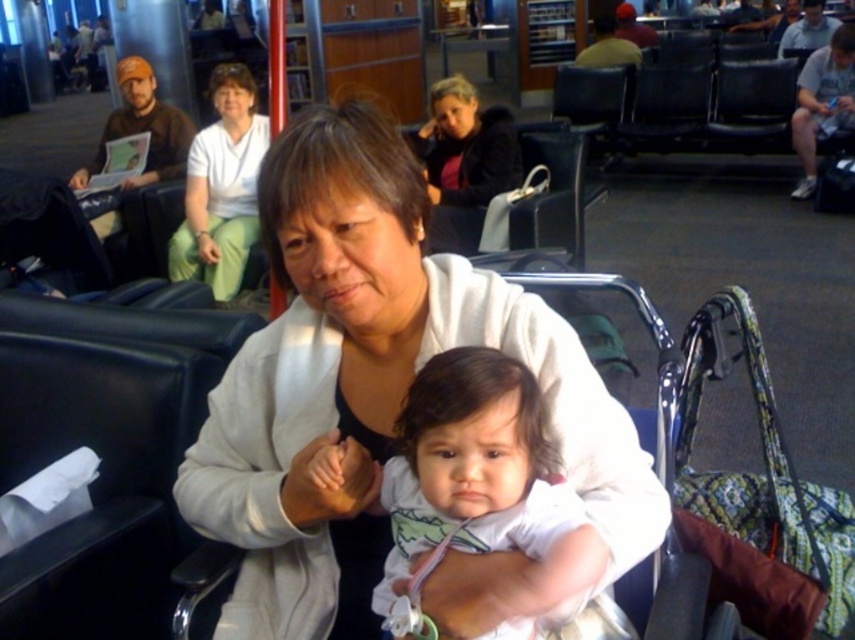
Can you confirm if white fabric shirt at upper center is shorter than matte black jacket at upper center?

No.

Does white fabric shirt at upper center have a greater width compared to matte black jacket at upper center?

Incorrect, white fabric shirt at upper center's width does not surpass matte black jacket at upper center's.

Describe the element at coordinates (221, 188) in the screenshot. The image size is (855, 640). I see `white fabric shirt at upper center` at that location.

Identify the location of white fabric shirt at upper center. This screenshot has width=855, height=640. pyautogui.click(x=221, y=188).

Between point (228, 488) and point (565, 596), which one is positioned behind?

Positioned behind is point (228, 488).

Between white soft jacket at center and white soft fabric baby at center, which one appears on the right side from the viewer's perspective?

white soft fabric baby at center

Who is more forward, (x=243, y=449) or (x=410, y=547)?

Point (x=410, y=547) is in front.

Locate an element on the screen. white soft jacket at center is located at coordinates [372, 385].

Which is behind, point (510, 538) or point (467, 179)?

Point (467, 179)

Who is positioned more to the right, white soft fabric baby at center or matte black jacket at upper center?

Positioned to the right is matte black jacket at upper center.

Does point (469, 355) come in front of point (475, 97)?

Yes, it is.

Where is `white soft fabric baby at center`? white soft fabric baby at center is located at coordinates (482, 477).